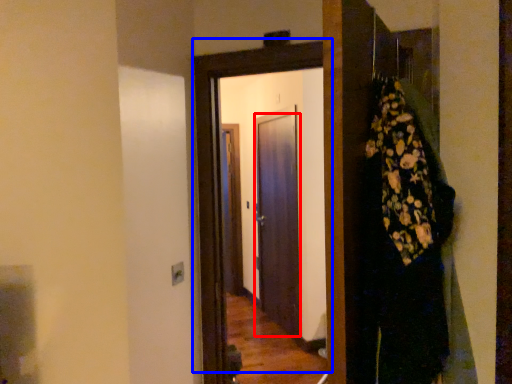
Question: Among these objects, which one is farthest to the camera, door (highlighted by a red box) or door (highlighted by a blue box)?

Choices:
 (A) door
 (B) door

Answer: (A)